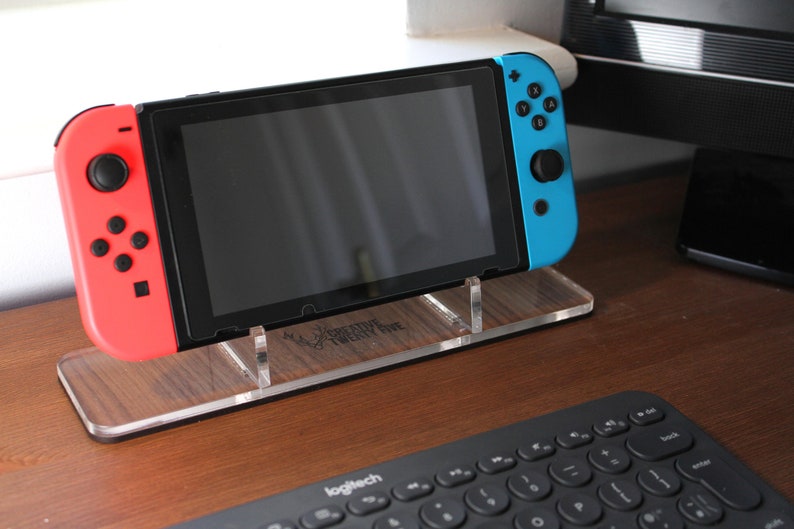
This screenshot has height=529, width=794. In order to click on glass screen in this screenshot , I will do `click(340, 171)`.